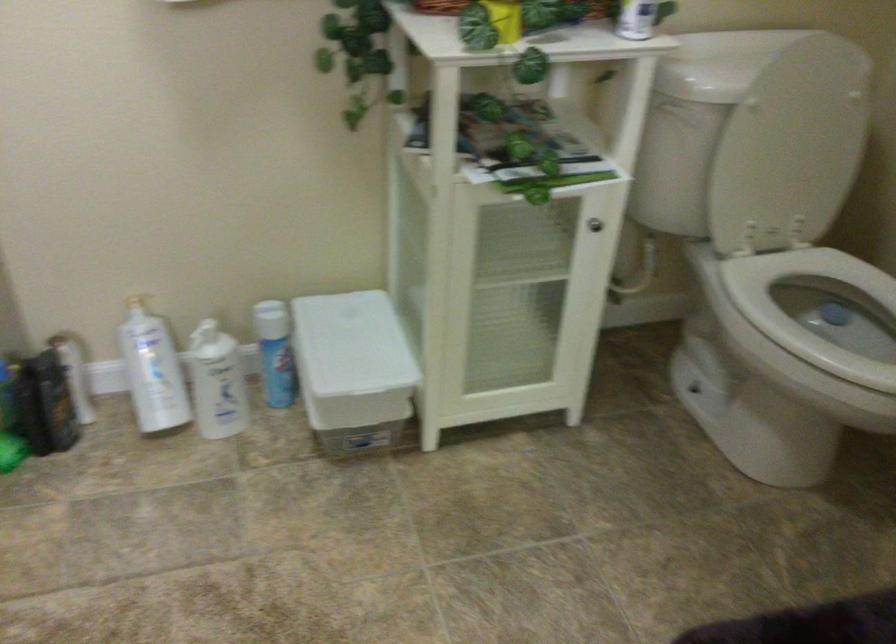
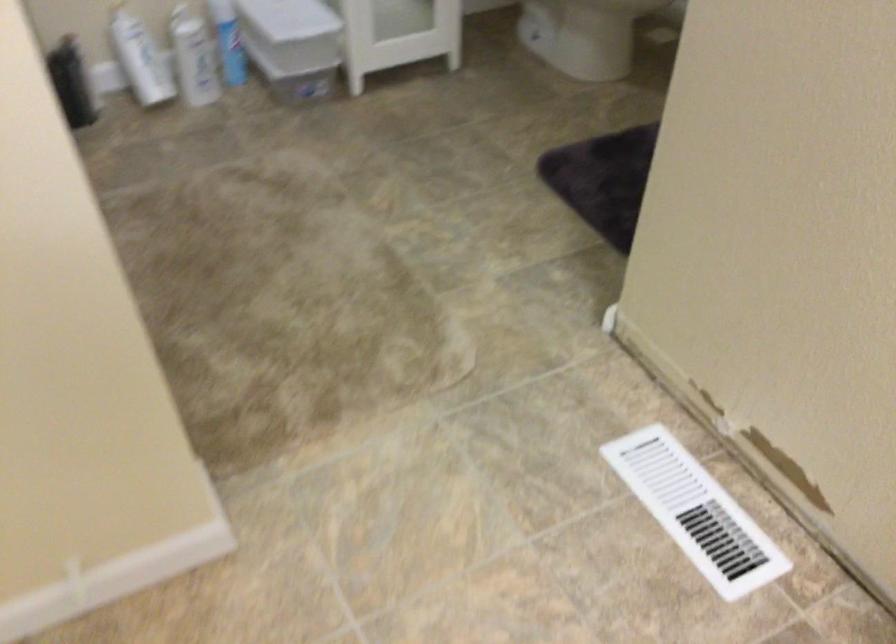
The point at (341, 375) is marked in the first image. Where is the corresponding point in the second image?

(293, 32)